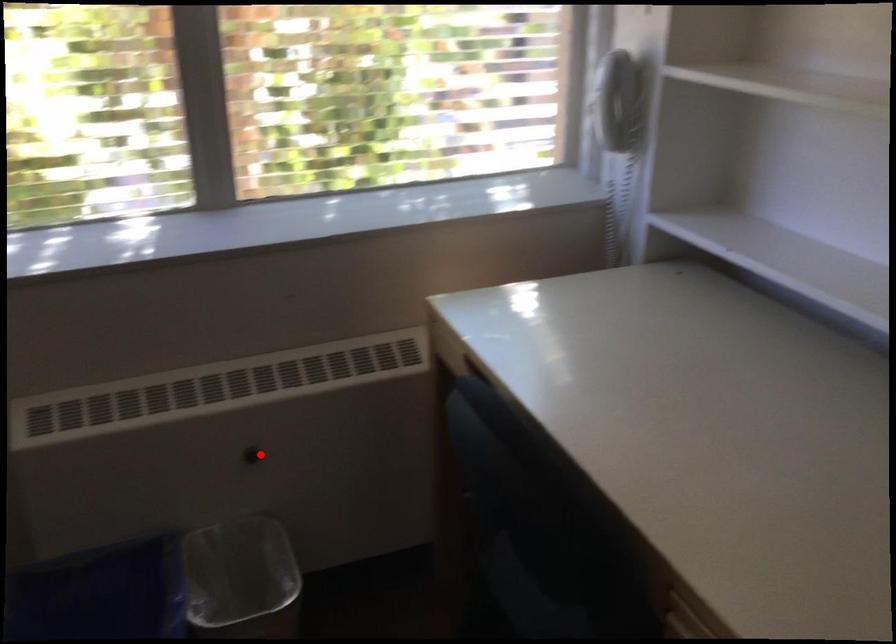
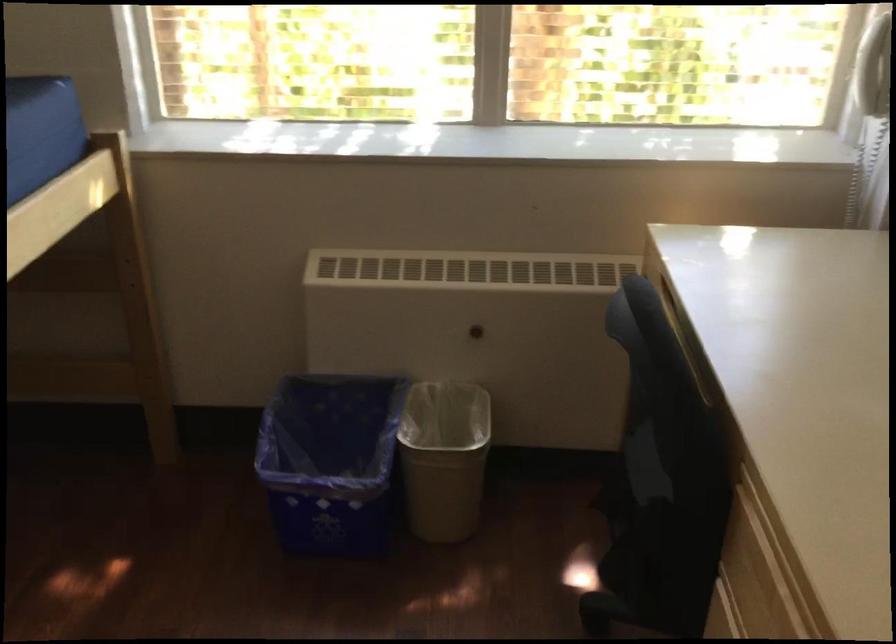
In the second image, find the point that corresponds to the highlighted location in the first image.

(476, 330)